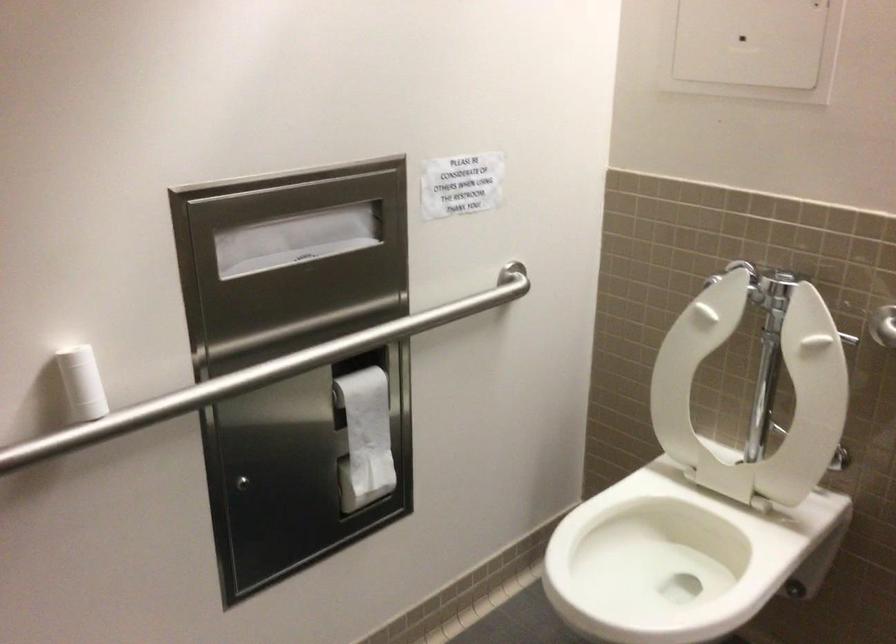
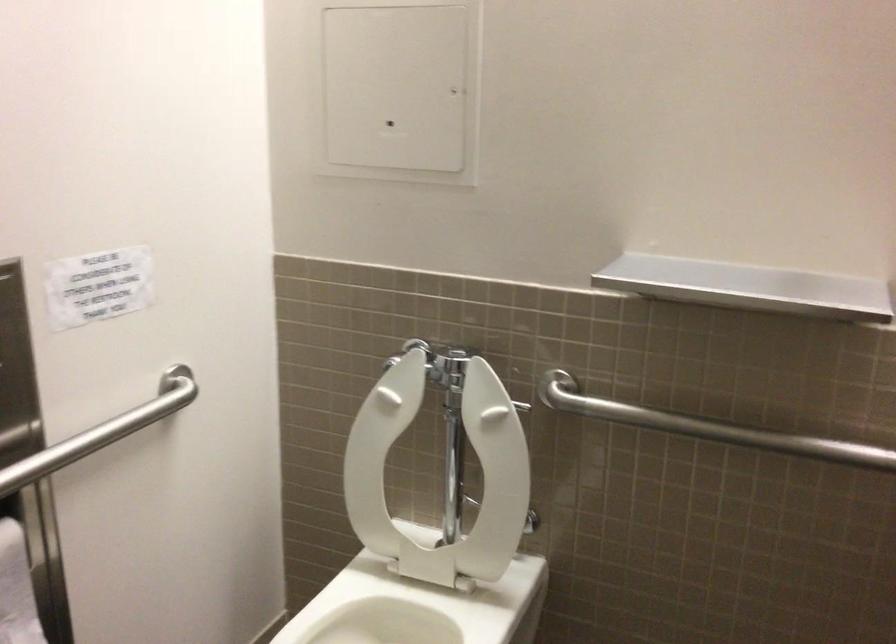
Question: In a continuous first-person perspective shot, in which direction is the camera moving?

Choices:
 (A) Left
 (B) Right
 (C) Forward
 (D) Backward

Answer: (C)